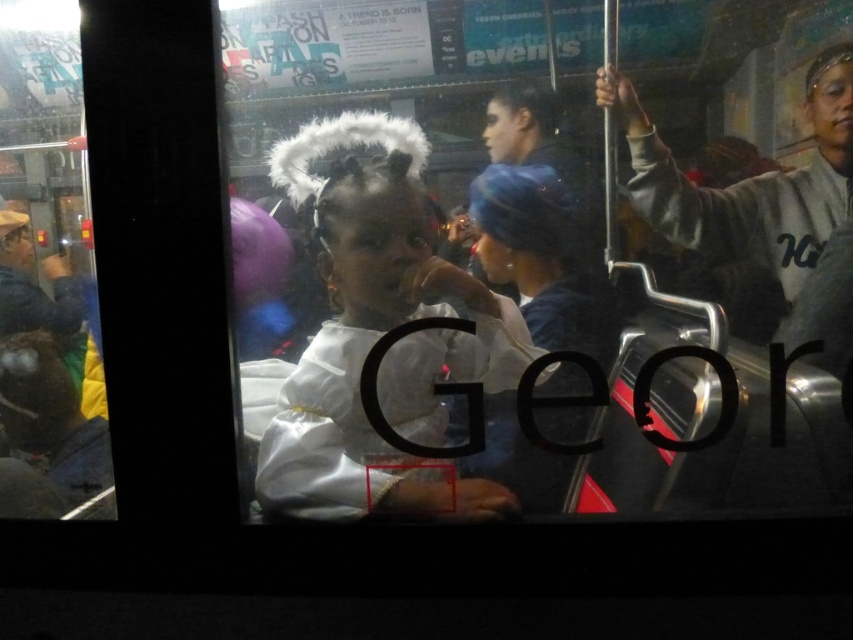
You are a passenger on a moving train and see two points marked in the scene through the window. The first point is at coordinate point (361, 262) and the second is at point (837, 84). Which point is closer to your eyes?

Point (361, 262) is further to the camera than point (837, 84), so the point closer to your eyes is point (837, 84).

You are a photographer trying to capture a clear shot of both the white fluffy halo at center and the gray fleece jacket at right. Based on their positions, which object should you focus on first to ensure both are in focus?

You should focus on the gray fleece jacket at right first because it is farther away than the white fluffy halo at center, so adjusting focus from there would help both objects come into clarity.

You are a photographer trying to capture a clear shot of the white fluffy halo at center and the gray fleece jacket at right. Since the halo is smaller than the jacket, which object should you zoom in more on to ensure both are equally visible in the photo?

The white fluffy halo at center is smaller than the gray fleece jacket at right, so you should zoom in more on the white fluffy halo at center to make it appear larger in the photo, balancing its size with the gray fleece jacket at right.